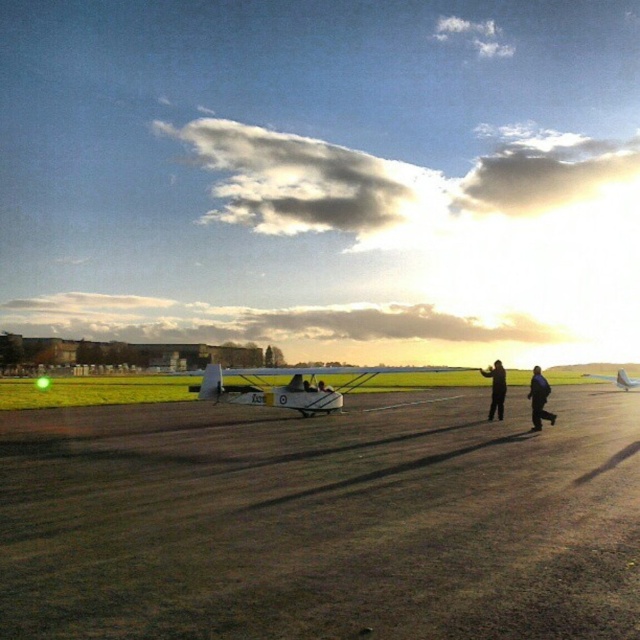
Question: Can you confirm if dirt/gritty runway at center is thinner than dark blue jeans at center?

Choices:
 (A) yes
 (B) no

Answer: (B)

Question: Which point is farther to the camera?

Choices:
 (A) dirt/gritty runway at center
 (B) white matte airplane at center

Answer: (B)

Question: Which point appears farthest from the camera in this image?

Choices:
 (A) (305, 397)
 (B) (52, 417)
 (C) (536, 371)

Answer: (B)

Question: Can you confirm if dark blue jeans at center is positioned below metallic silver airplane at center?

Choices:
 (A) no
 (B) yes

Answer: (A)

Question: Is dirt/gritty runway at center above white matte airplane at center?

Choices:
 (A) yes
 (B) no

Answer: (A)

Question: Which of the following is the closest to the observer?

Choices:
 (A) black matte jacket at center
 (B) white matte airplane at center
 (C) dark blue jeans at center

Answer: (C)